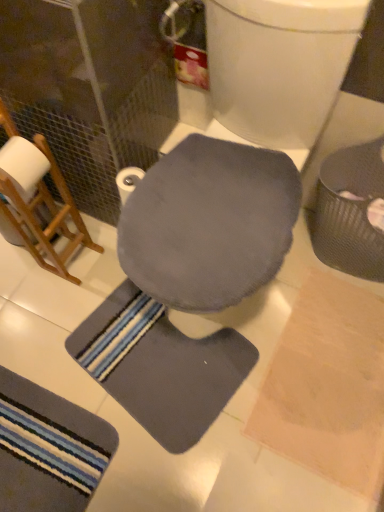
Question: From a real-world perspective, is striped fabric bath mat at lower left, positioned as the second bath mat in right-to-left order, under metallic textured trash can at right?

Choices:
 (A) no
 (B) yes

Answer: (B)

Question: From a real-world perspective, is striped fabric bath mat at lower left, positioned as the second bath mat in right-to-left order, on top of metallic textured trash can at right?

Choices:
 (A) yes
 (B) no

Answer: (B)

Question: Considering the relative sizes of striped fabric bath mat at lower left, acting as the first bath mat starting from the left, and metallic textured trash can at right in the image provided, is striped fabric bath mat at lower left, acting as the first bath mat starting from the left, smaller than metallic textured trash can at right?

Choices:
 (A) yes
 (B) no

Answer: (A)

Question: Can you confirm if striped fabric bath mat at lower left, acting as the first bath mat starting from the left, is bigger than metallic textured trash can at right?

Choices:
 (A) no
 (B) yes

Answer: (A)

Question: From the image's perspective, would you say striped fabric bath mat at lower left, positioned as the second bath mat in right-to-left order, is positioned over metallic textured trash can at right?

Choices:
 (A) yes
 (B) no

Answer: (B)

Question: From a real-world perspective, is gray soft mat at center, which is the second bath mat from left to right, physically located above or below white matte toilet paper at center?

Choices:
 (A) below
 (B) above

Answer: (A)

Question: Visually, is gray soft mat at center, acting as the first bath mat starting from the right, positioned to the left or to the right of white matte toilet paper at center?

Choices:
 (A) right
 (B) left

Answer: (A)

Question: Is gray soft mat at center, which is the second bath mat from left to right, bigger or smaller than white matte toilet paper at center?

Choices:
 (A) small
 (B) big

Answer: (B)

Question: From the image's perspective, is gray soft mat at center, which is the second bath mat from left to right, positioned above or below white matte toilet paper at center?

Choices:
 (A) above
 (B) below

Answer: (B)

Question: From the image's perspective, is gray soft mat at center, acting as the first bath mat starting from the right, positioned above or below matte gray swivel chair at center?

Choices:
 (A) above
 (B) below

Answer: (B)

Question: In terms of size, does gray soft mat at center, which is the second bath mat from left to right, appear bigger or smaller than matte gray swivel chair at center?

Choices:
 (A) big
 (B) small

Answer: (B)

Question: Choose the correct answer: Is gray soft mat at center, acting as the first bath mat starting from the right, inside matte gray swivel chair at center or outside it?

Choices:
 (A) outside
 (B) inside

Answer: (A)

Question: From their relative heights in the image, would you say gray soft mat at center, acting as the first bath mat starting from the right, is taller or shorter than matte gray swivel chair at center?

Choices:
 (A) tall
 (B) short

Answer: (B)

Question: Is matte gray swivel chair at center bigger or smaller than gray soft mat at center, acting as the first bath mat starting from the right?

Choices:
 (A) big
 (B) small

Answer: (A)

Question: Considering the positions of point (231, 257) and point (225, 329), is point (231, 257) closer or farther from the camera than point (225, 329)?

Choices:
 (A) closer
 (B) farther

Answer: (A)